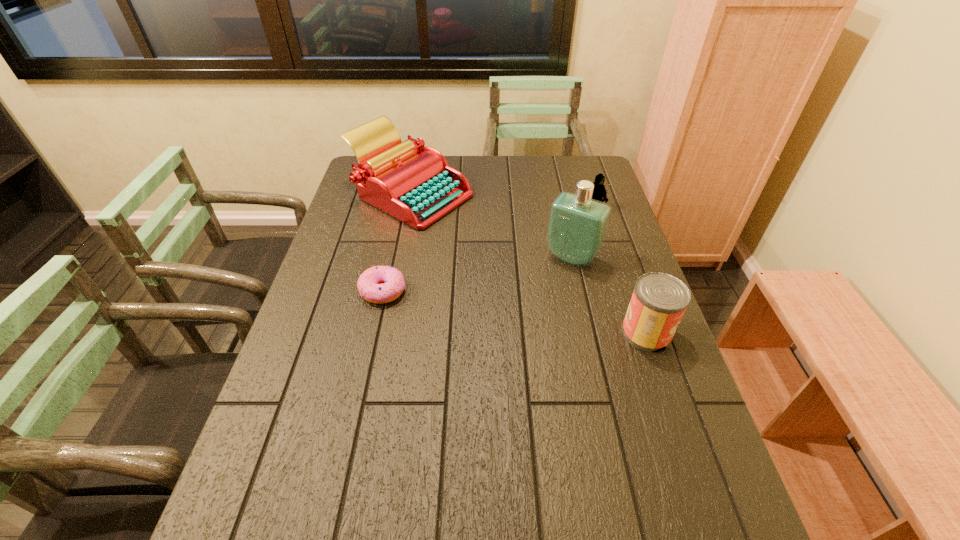
Where is `doughnut present at the left edge`? This screenshot has height=540, width=960. doughnut present at the left edge is located at coordinates (369, 287).

The width and height of the screenshot is (960, 540). I want to click on typewriter that is positioned at the left edge, so click(x=413, y=183).

Where is `can that is at the right edge`? Image resolution: width=960 pixels, height=540 pixels. can that is at the right edge is located at coordinates (659, 300).

Find the location of a particular element. The height and width of the screenshot is (540, 960). perfume at the right edge is located at coordinates (577, 227).

Identify the location of Lego located in the right edge section of the desktop. (599, 193).

I want to click on object that is at the far left corner, so click(x=413, y=183).

Where is `vacant area at the far edge`? The image size is (960, 540). vacant area at the far edge is located at coordinates (496, 168).

In the image, there is a desktop. In order to click on vacant space at the left edge in this screenshot , I will do 353,195.

In the image, there is a desktop. At what (x,y) coordinates should I click in order to perform the action: click on free space at the near left corner. Please return your answer as a coordinate pair (x, y). Image resolution: width=960 pixels, height=540 pixels. Looking at the image, I should click on (282, 480).

Image resolution: width=960 pixels, height=540 pixels. What are the coordinates of `free space that is in between the shortest object and the fourth tallest object` in the screenshot? It's located at (489, 249).